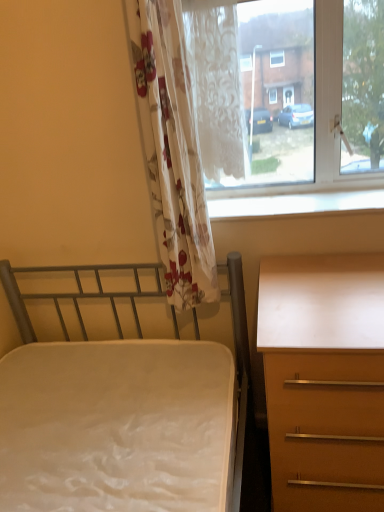
Question: Considering their positions, is matte brown desk at right located in front of or behind transparent glass window at upper right?

Choices:
 (A) behind
 (B) front

Answer: (B)

Question: In the image, is matte brown desk at right on the left side or the right side of transparent glass window at upper right?

Choices:
 (A) left
 (B) right

Answer: (B)

Question: Considering the real-world distances, which object is closest to the metallic gray bed at left?

Choices:
 (A) transparent glass window at upper right
 (B) matte brown desk at right
 (C) floral fabric curtain at left, marked as the second curtain in a right-to-left arrangement
 (D) white lace curtain at upper center, positioned as the 1th curtain in right-to-left order
 (E) white glossy window sill at upper center

Answer: (C)

Question: Based on their relative distances, which object is farther from the floral fabric curtain at left, marked as the first curtain in a left-to-right arrangement?

Choices:
 (A) white glossy window sill at upper center
 (B) matte brown desk at right
 (C) metallic gray bed at left
 (D) white lace curtain at upper center, positioned as the 1th curtain in right-to-left order
 (E) transparent glass window at upper right

Answer: (B)